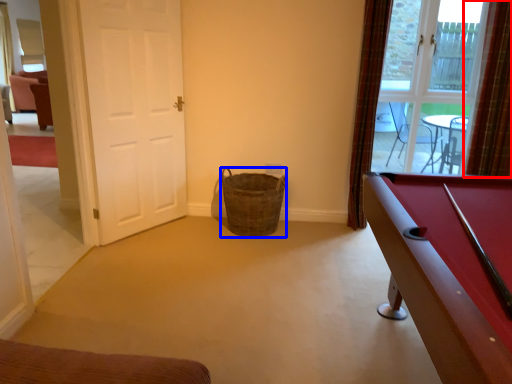
Question: Which point is further to the camera, curtain (highlighted by a red box) or basket (highlighted by a blue box)?

Choices:
 (A) curtain
 (B) basket

Answer: (B)